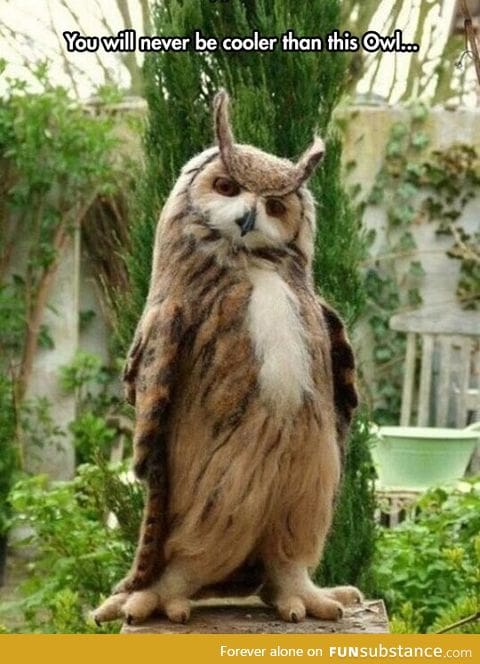
Locate an element on the screen. The height and width of the screenshot is (664, 480). bucket is located at coordinates (423, 459).